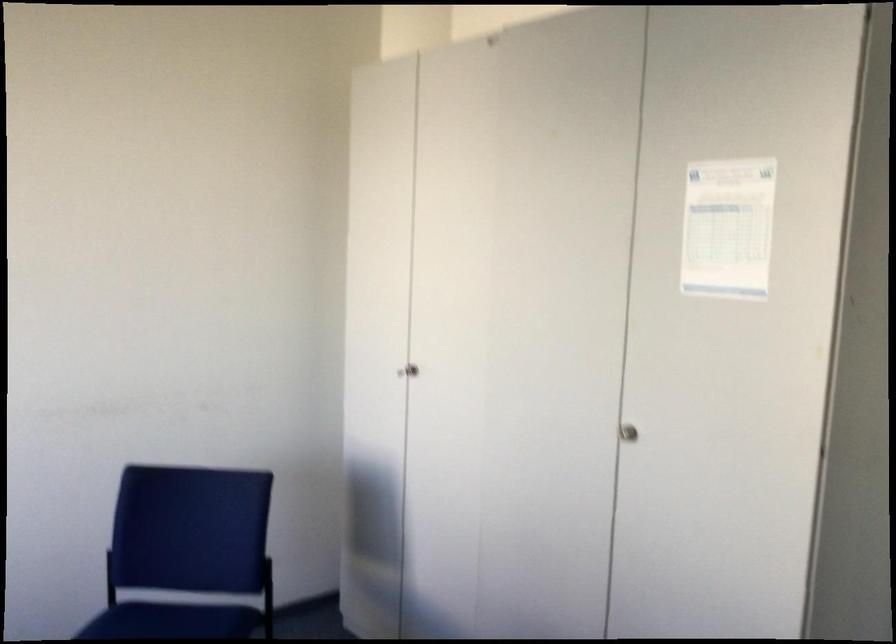
Locate an element on the screen. chair sitting surface is located at coordinates (179, 623).